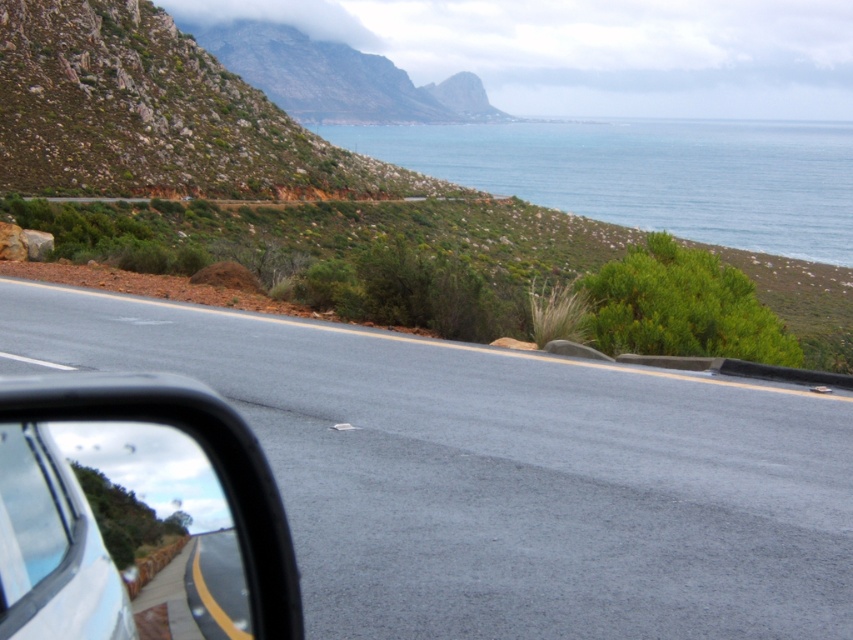
Is point (271, 560) positioned before point (13, 596)?

No, it is not.

Can you confirm if black rubber side mirror at lower left is bigger than transparent glass car window at lower left?

Indeed, black rubber side mirror at lower left has a larger size compared to transparent glass car window at lower left.

Where is `black rubber side mirror at lower left`? black rubber side mirror at lower left is located at coordinates (134, 506).

Between asphalt road at center and black rubber side mirror at lower left, which one appears on the right side from the viewer's perspective?

asphalt road at center

Which is more to the left, asphalt road at center or black rubber side mirror at lower left?

Positioned to the left is black rubber side mirror at lower left.

Does point (496, 432) come farther from viewer compared to point (206, 524)?

Yes, point (496, 432) is farther from viewer.

The height and width of the screenshot is (640, 853). Find the location of `asphalt road at center`. asphalt road at center is located at coordinates (503, 476).

Does blue water at upper right have a greater width compared to transparent glass car window at lower left?

Correct, the width of blue water at upper right exceeds that of transparent glass car window at lower left.

Which is in front, point (809, 141) or point (76, 516)?

Positioned in front is point (76, 516).

You are a GUI agent. You are given a task and a screenshot of the screen. Output one action in this format:
    pyautogui.click(x=<x>, y=<y>)
    Task: Click on the blue water at upper right
    This screenshot has width=853, height=640.
    Given the screenshot: What is the action you would take?
    650,173